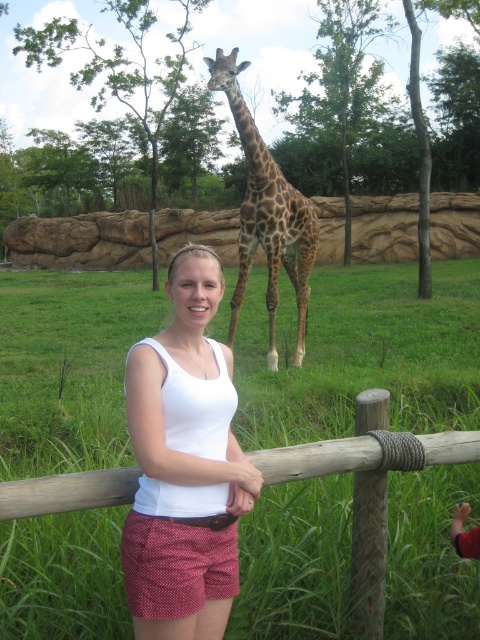
Which is above, spotted fur giraffe at center or wooden fence post at center?

Positioned higher is spotted fur giraffe at center.

Does spotted fur giraffe at center appear over wooden fence post at center?

Correct, spotted fur giraffe at center is located above wooden fence post at center.

Measure the distance between point (241, 138) and camera.

24.40 feet

Identify the location of spotted fur giraffe at center. Image resolution: width=480 pixels, height=640 pixels. (266, 216).

Which is below, wooden post at center or wooden fence post at center?

wooden post at center is lower down.

Is wooden post at center bigger than wooden fence post at center?

Yes, wooden post at center is bigger than wooden fence post at center.

You are a GUI agent. You are given a task and a screenshot of the screen. Output one action in this format:
    pyautogui.click(x=<x>, y=<y>)
    Task: Click on the wooden post at center
    
    Given the screenshot: What is the action you would take?
    pyautogui.click(x=296, y=563)

Is wooden post at center closer to camera compared to white cotton tank top at center?

No.

Which of these two, wooden post at center or white cotton tank top at center, stands shorter?

Standing shorter between the two is wooden post at center.

Describe the element at coordinates (296, 563) in the screenshot. I see `wooden post at center` at that location.

This screenshot has width=480, height=640. Find the location of `wooden post at center`. wooden post at center is located at coordinates (296, 563).